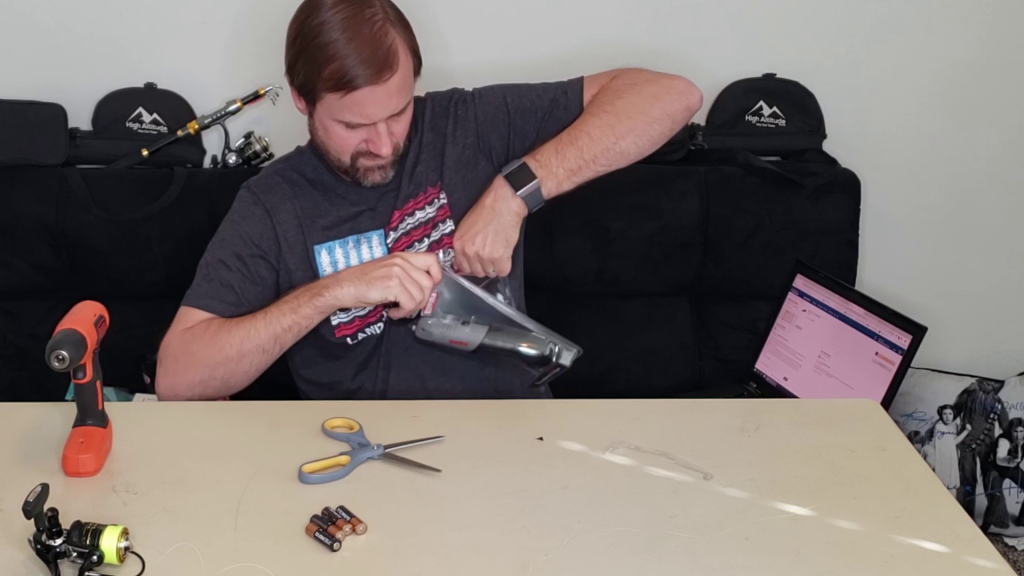
Where is `laptop`? Image resolution: width=1024 pixels, height=576 pixels. laptop is located at coordinates (840, 354).